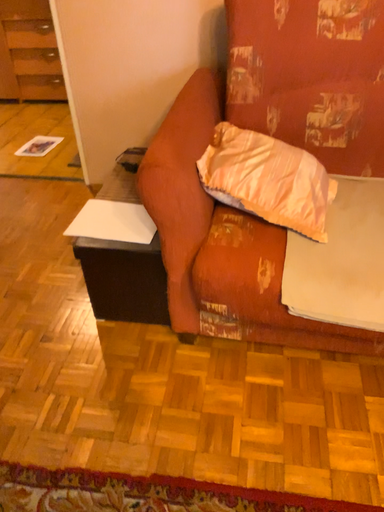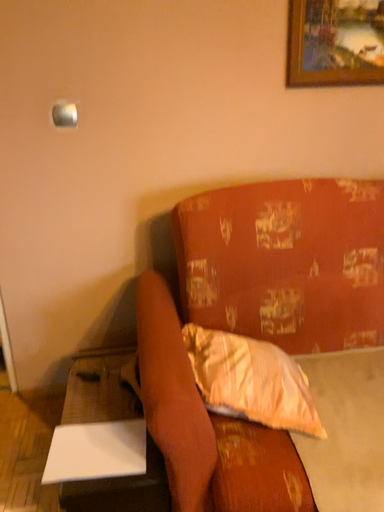
Question: Which way did the camera rotate in the video?

Choices:
 (A) rotated downward
 (B) rotated upward

Answer: (B)